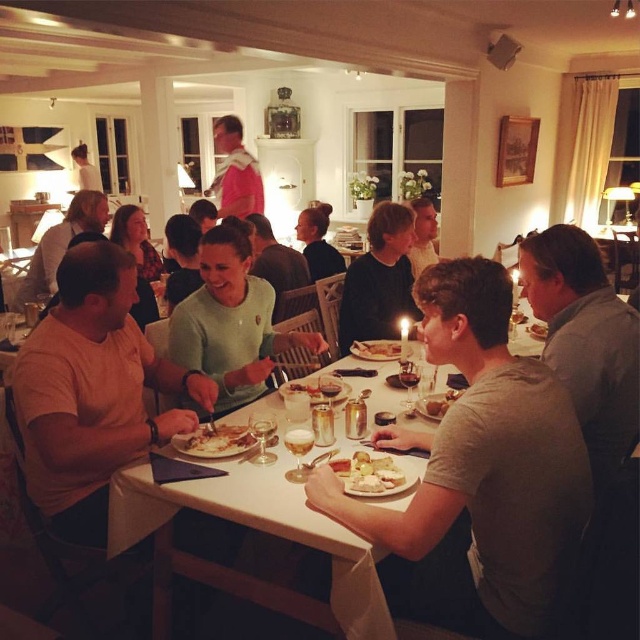
Is point (212, 355) in front of point (362, 344)?

Yes, point (212, 355) is closer to viewer.

I want to click on green matte sweater at center, so click(230, 323).

Does white creamy pasta at center come behind golden brown bread at center?

No, it is not.

What are the coordinates of `white creamy pasta at center` in the screenshot? It's located at coord(216,440).

Does light brown t-shirt at left have a smaller size compared to light brown wooden chair at left?

Actually, light brown t-shirt at left might be larger than light brown wooden chair at left.

Is point (93, 492) in front of point (52, 243)?

Yes, it is.

Between point (129, 342) and point (96, 225), which one is positioned behind?

Point (96, 225)

Locate an element on the screen. light brown t-shirt at left is located at coordinates (92, 392).